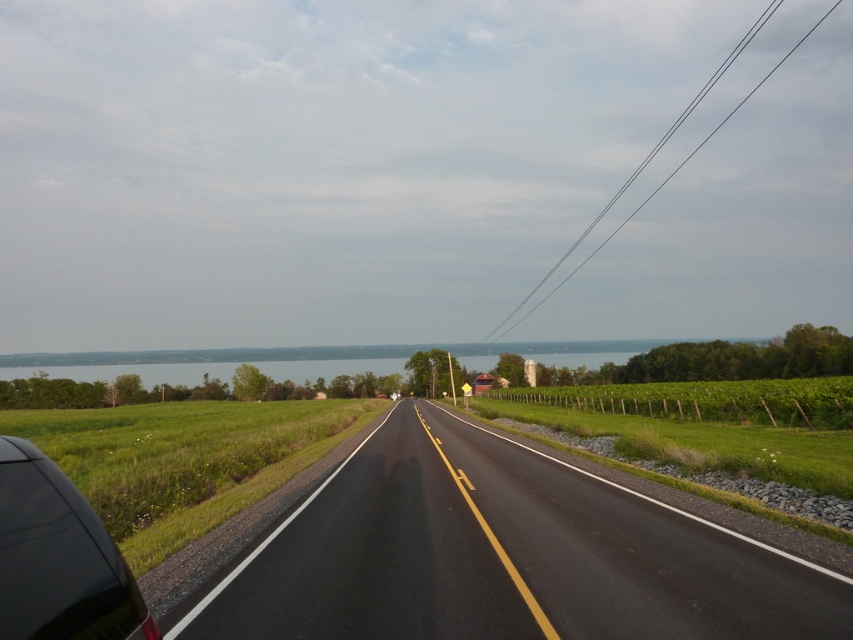
Question: Which of the following is the farthest from the observer?

Choices:
 (A) (125, 609)
 (B) (461, 497)

Answer: (B)

Question: From the image, what is the correct spatial relationship of black asphalt highway at center in relation to shiny black car at lower left?

Choices:
 (A) below
 (B) above

Answer: (A)

Question: Which point appears farthest from the camera in this image?

Choices:
 (A) 111,556
 (B) 631,636

Answer: (B)

Question: Is black asphalt highway at center smaller than shiny black car at lower left?

Choices:
 (A) no
 (B) yes

Answer: (B)

Question: Can you confirm if black asphalt highway at center is positioned to the right of shiny black car at lower left?

Choices:
 (A) yes
 (B) no

Answer: (A)

Question: Which point is closer to the camera?

Choices:
 (A) (49, 528)
 (B) (834, 576)

Answer: (A)